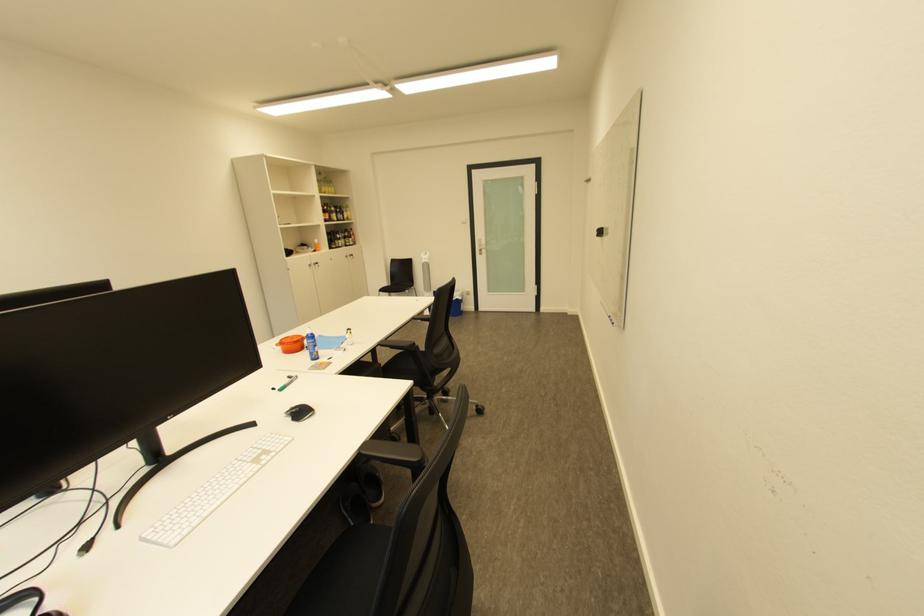
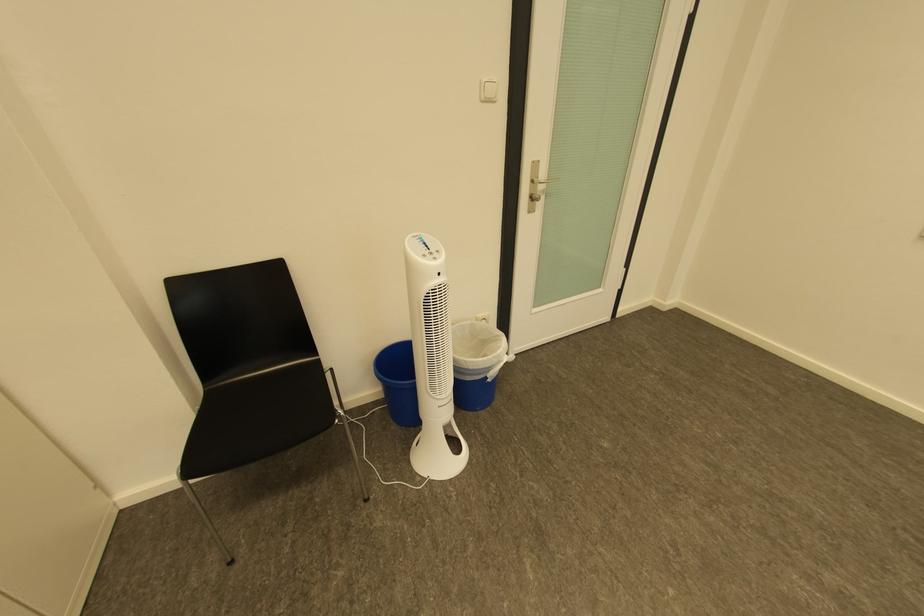
Find the pixel in the second image that matches point 433,257 in the first image.

(439, 262)